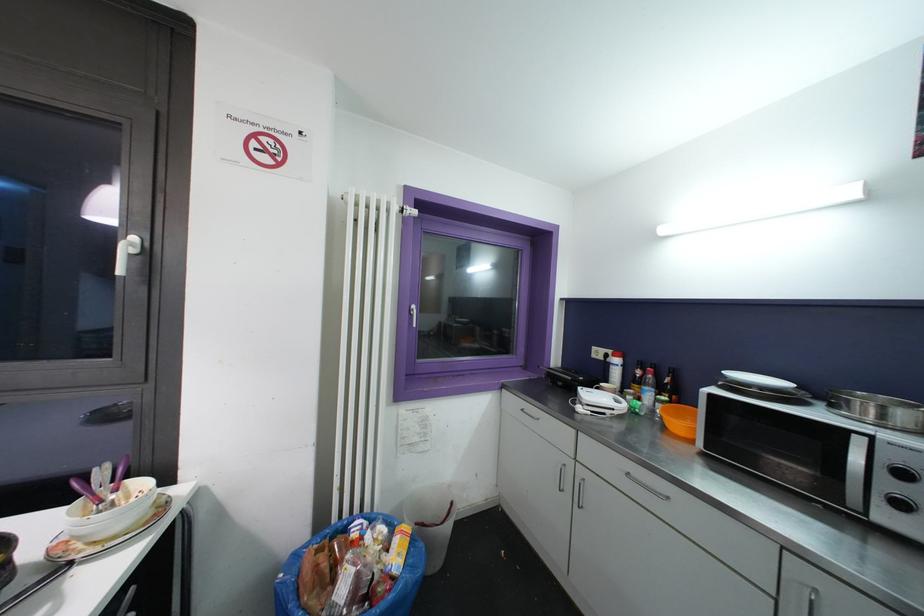
Where would you lift the orange plastic bowl? Please return your answer as a coordinate pair (x, y).

(679, 419)